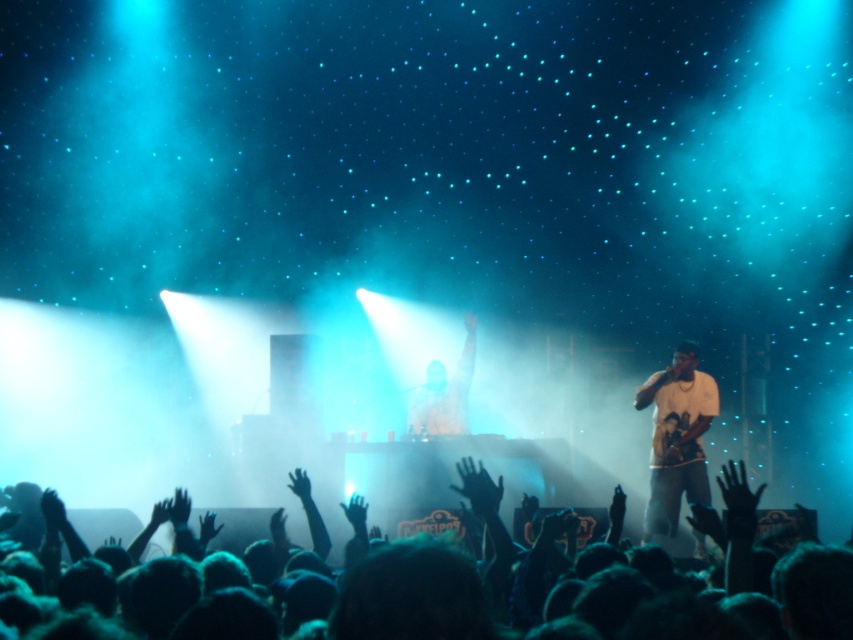
Question: Does black hair at lower center come in front of white cotton shirt at center?

Choices:
 (A) yes
 (B) no

Answer: (A)

Question: Can you confirm if black hair at lower center is bigger than white cotton shirt at center?

Choices:
 (A) no
 (B) yes

Answer: (B)

Question: Which point is closer to the camera?

Choices:
 (A) white cotton shirt at center
 (B) black hair at lower center

Answer: (B)

Question: Does black hair at lower center have a smaller size compared to white cotton shirt at center?

Choices:
 (A) no
 (B) yes

Answer: (A)

Question: Which point is closer to the camera taking this photo?

Choices:
 (A) (502, 563)
 (B) (653, 531)

Answer: (A)

Question: Which point is farther to the camera?

Choices:
 (A) black hair at lower center
 (B) white cotton shirt at center

Answer: (B)